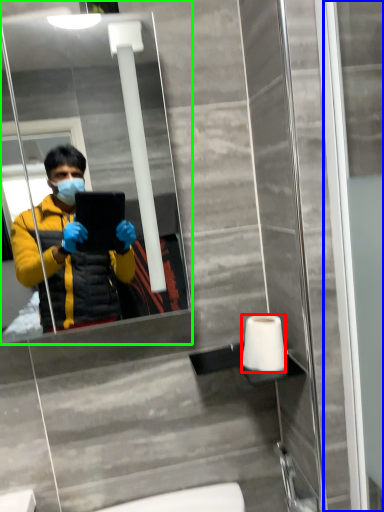
Question: Estimate the real-world distances between objects in this image. Which object is farther from toilet paper (highlighted by a red box), screen door (highlighted by a blue box) or mirror (highlighted by a green box)?

Choices:
 (A) screen door
 (B) mirror

Answer: (B)